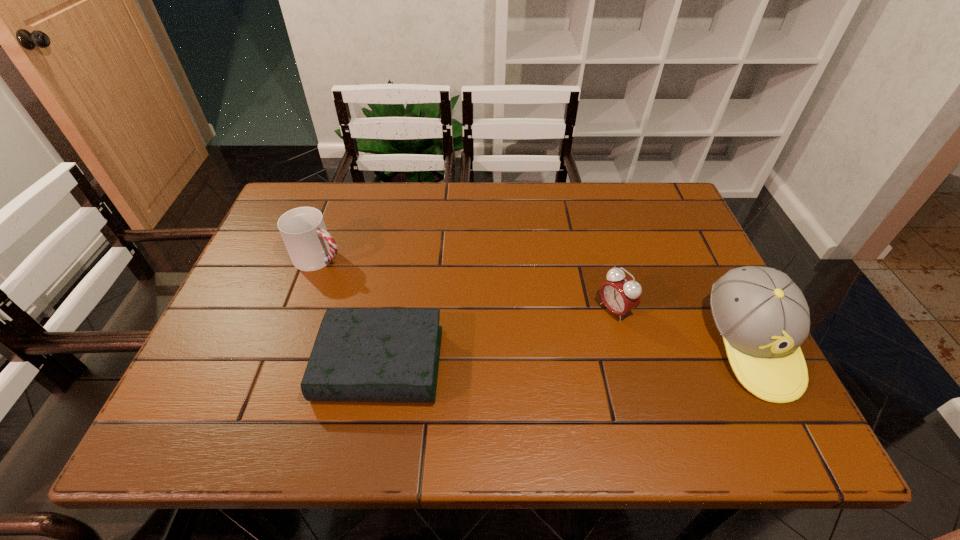
The image size is (960, 540). I want to click on vacant area between the second object from right to left and the Bible, so click(497, 337).

Where is `unoccupied area between the baseball cap and the leftmost object`? This screenshot has width=960, height=540. unoccupied area between the baseball cap and the leftmost object is located at coordinates (536, 301).

Locate which object ranks in proximity to the Bible. Please provide its 2D coordinates. Your answer should be formatted as a tuple, i.e. [(x, y)], where the tuple contains the x and y coordinates of a point satisfying the conditions above.

[(310, 247)]

This screenshot has height=540, width=960. I want to click on object that stands as the closest to the Bible, so click(x=310, y=247).